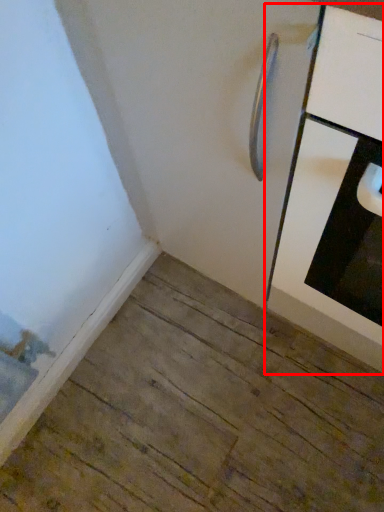
Question: From the image, what is the correct spatial relationship of cabinetry (annotated by the red box) in relation to door?

Choices:
 (A) left
 (B) right

Answer: (B)